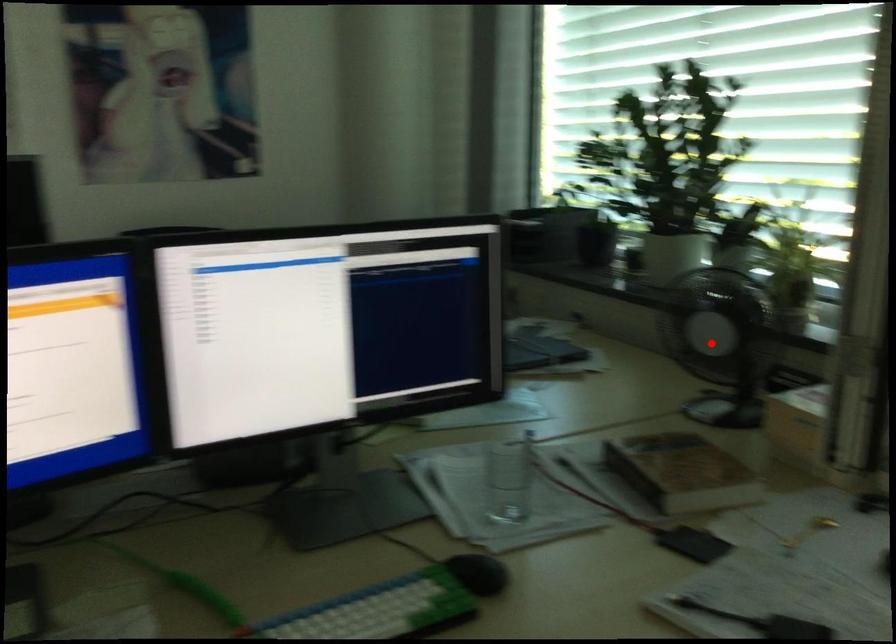
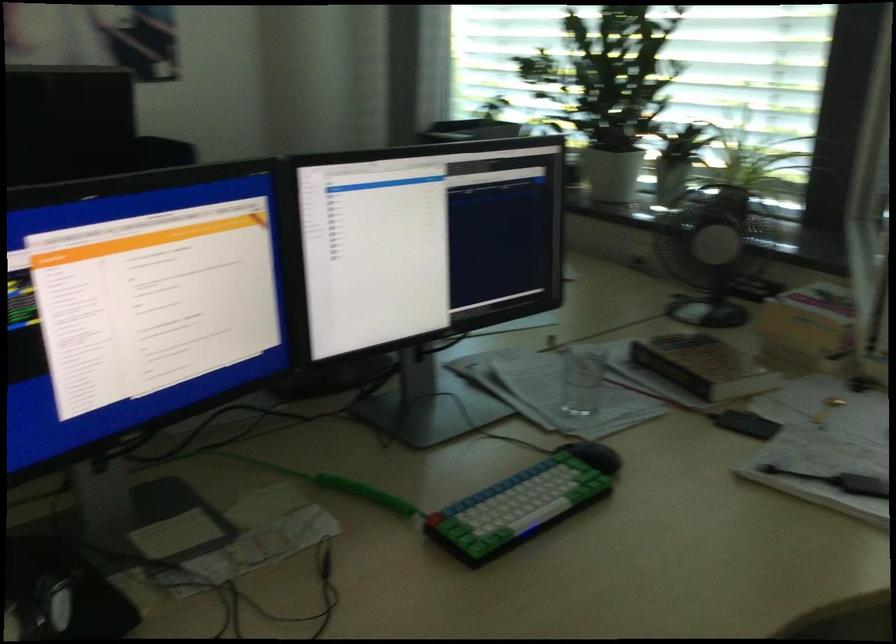
Where in the second image is the point corresponding to the highlighted location from the first image?

(711, 252)